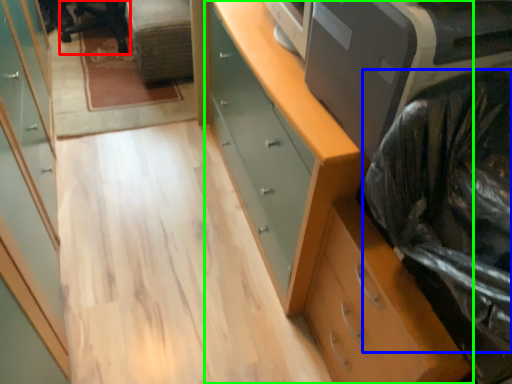
Question: Estimate the real-world distances between objects in this image. Which object is farther from computer chair (highlighted by a red box), garbage (highlighted by a blue box) or chest of drawers (highlighted by a green box)?

Choices:
 (A) garbage
 (B) chest of drawers

Answer: (A)